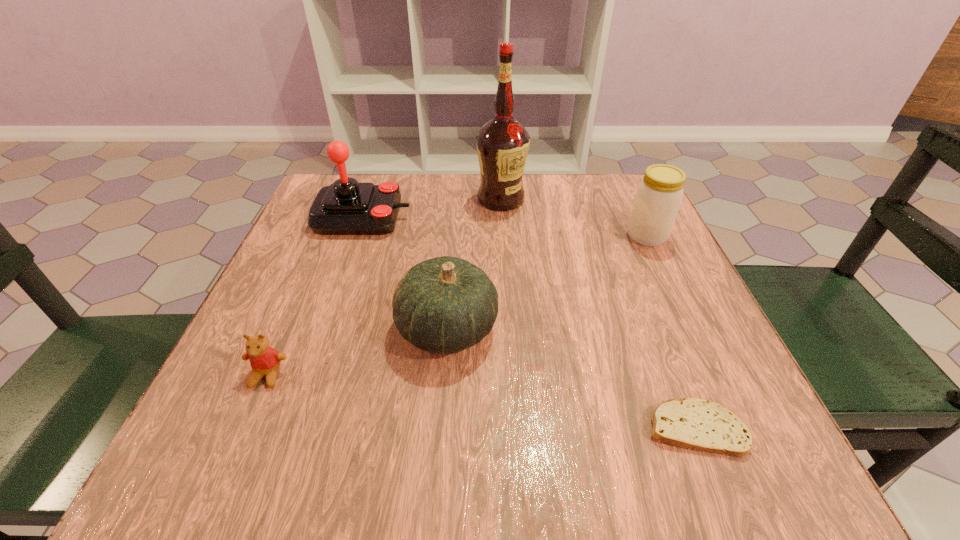
Locate an element on the screen. This screenshot has width=960, height=540. free space located 0.270m on the left of the gourd is located at coordinates (246, 328).

Find the location of a particular element. vacant space situated 0.060m on the front-facing side of the second shortest object is located at coordinates (246, 425).

Where is `vacant space situated 0.380m on the left of the pita bread`? This screenshot has height=540, width=960. vacant space situated 0.380m on the left of the pita bread is located at coordinates (387, 428).

Locate an element on the screen. Image resolution: width=960 pixels, height=540 pixels. alcohol at the far edge is located at coordinates (502, 143).

At what (x,y) coordinates should I click in order to perform the action: click on joystick located at the far edge. Please return your answer as a coordinate pair (x, y). Looking at the image, I should click on (346, 207).

Locate an element on the screen. jar that is at the far edge is located at coordinates (658, 197).

The height and width of the screenshot is (540, 960). I want to click on object situated at the near edge, so click(x=693, y=423).

I want to click on joystick that is at the left edge, so click(346, 207).

Locate an element on the screen. teddy bear positioned at the left edge is located at coordinates (265, 361).

Where is `jar that is at the right edge`? jar that is at the right edge is located at coordinates (658, 197).